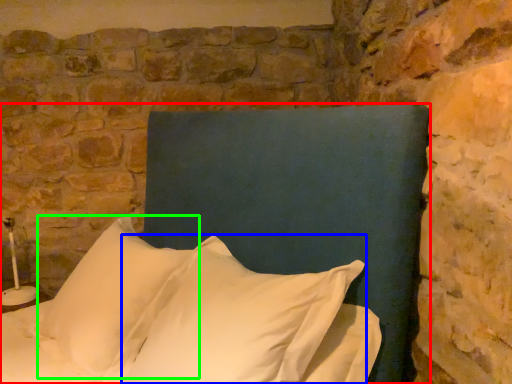
Question: Estimate the real-world distances between objects in this image. Which object is closer to bed (highlighted by a red box), pillow (highlighted by a blue box) or pillow (highlighted by a green box)?

Choices:
 (A) pillow
 (B) pillow

Answer: (A)